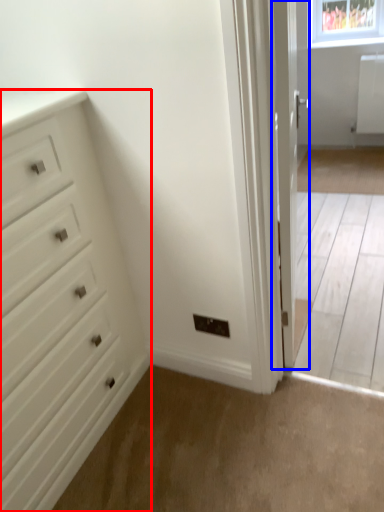
Question: Which object appears farthest to the camera in this image, chest of drawers (highlighted by a red box) or door (highlighted by a blue box)?

Choices:
 (A) chest of drawers
 (B) door

Answer: (B)